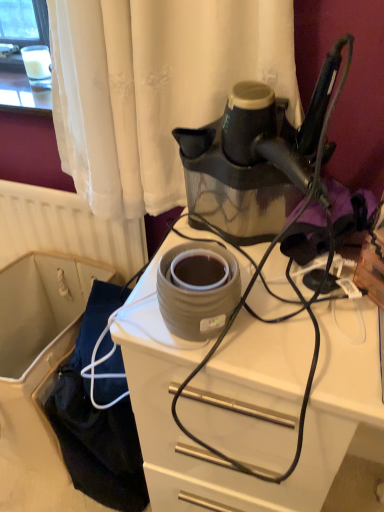
The height and width of the screenshot is (512, 384). Identify the location of spots to the right of matte gray ceramic pot at center. (296, 326).